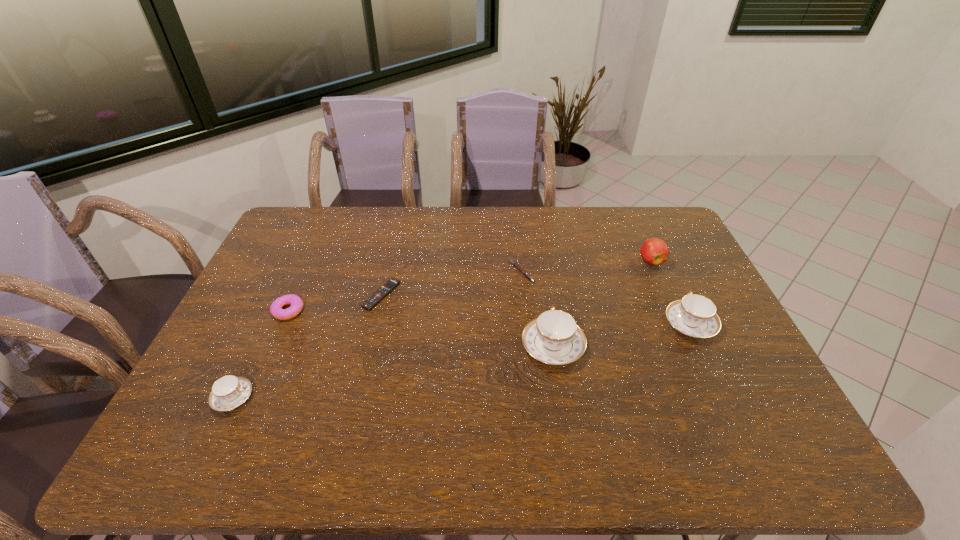
Where is `free space located 0.270m on the side with the handle of the second teacup from right to left`? The height and width of the screenshot is (540, 960). free space located 0.270m on the side with the handle of the second teacup from right to left is located at coordinates (540, 263).

You are a GUI agent. You are given a task and a screenshot of the screen. Output one action in this format:
    pyautogui.click(x=<x>, y=<y>)
    Task: Click on the free space located 0.070m on the side with the handle of the second teacup from right to left
    Image resolution: width=960 pixels, height=540 pixels.
    Given the screenshot: What is the action you would take?
    pyautogui.click(x=546, y=306)

You are a GUI agent. You are given a task and a screenshot of the screen. Output one action in this format:
    pyautogui.click(x=<x>, y=<y>)
    Task: Click on the vacant region located 0.150m on the side with the handle of the second teacup from right to left
    The image size is (960, 540).
    Given the screenshot: What is the action you would take?
    pyautogui.click(x=543, y=287)

Locate an element on the screen. This screenshot has height=540, width=960. vacant space situated on the side with the handle of the second shortest teacup is located at coordinates (661, 263).

Locate an element on the screen. Image resolution: width=960 pixels, height=540 pixels. vacant region located 0.230m on the side with the handle of the second shortest teacup is located at coordinates [x=659, y=258].

The width and height of the screenshot is (960, 540). Identify the location of free location located on the side with the handle of the second shortest teacup. (659, 258).

Where is `free location located 0.050m at the nib of the pen`? The image size is (960, 540). free location located 0.050m at the nib of the pen is located at coordinates (494, 271).

At what (x,y) coordinates should I click in order to perform the action: click on free point located at the nib of the pen. Please return your answer as a coordinate pair (x, y). Looking at the image, I should click on (448, 271).

Locate an element on the screen. This screenshot has height=540, width=960. vacant area located 0.280m at the nib of the pen is located at coordinates (424, 271).

Locate an element on the screen. This screenshot has width=960, height=540. free location located 0.080m on the left of the shortest object is located at coordinates (339, 295).